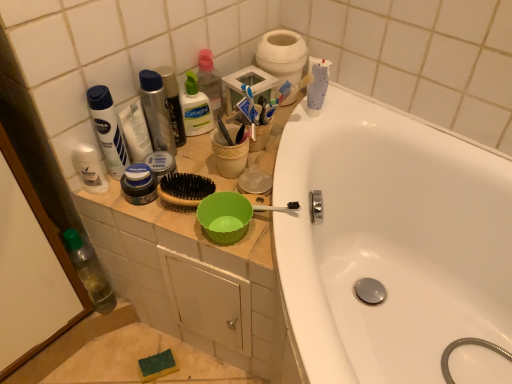
I want to click on free spot in front of white matte toothpaste at upper right, the second toothpaste from the left, so click(298, 152).